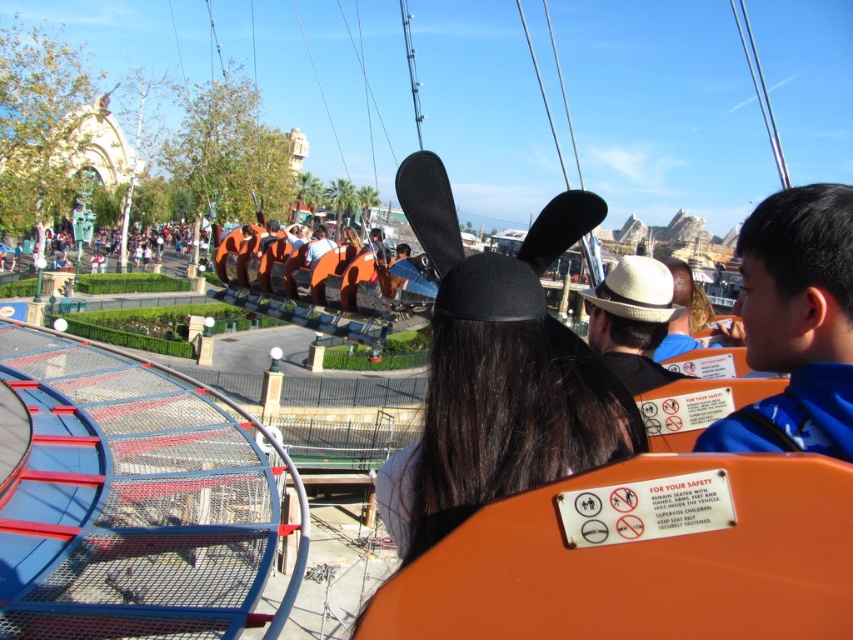
Question: Among these objects, which one is farthest from the camera?

Choices:
 (A) black fabric hat at upper center
 (B) orange fabric crowd at center
 (C) black fabric hat at center
 (D) orange fabric shirt at center

Answer: (B)

Question: Observing the image, what is the correct spatial positioning of orange fabric crowd at center in reference to orange fabric shirt at center?

Choices:
 (A) left
 (B) right

Answer: (A)

Question: Is black fabric hat at center bigger than black fabric hat at upper center?

Choices:
 (A) no
 (B) yes

Answer: (A)

Question: Is black fabric hat at center further to camera compared to orange fabric crowd at center?

Choices:
 (A) no
 (B) yes

Answer: (A)

Question: Which object is positioned closest to the orange fabric shirt at center?

Choices:
 (A) straw hat at center
 (B) orange fabric crowd at center

Answer: (A)

Question: Considering the real-world distances, which object is farthest from the orange fabric crowd at center?

Choices:
 (A) straw hat at center
 (B) orange fabric shirt at center

Answer: (A)